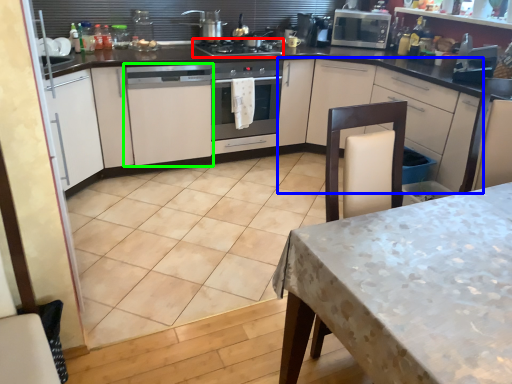
Question: Estimate the real-world distances between objects in this image. Which object is farther from gas stove (highlighted by a red box), cabinetry (highlighted by a blue box) or cabinetry (highlighted by a green box)?

Choices:
 (A) cabinetry
 (B) cabinetry

Answer: (A)